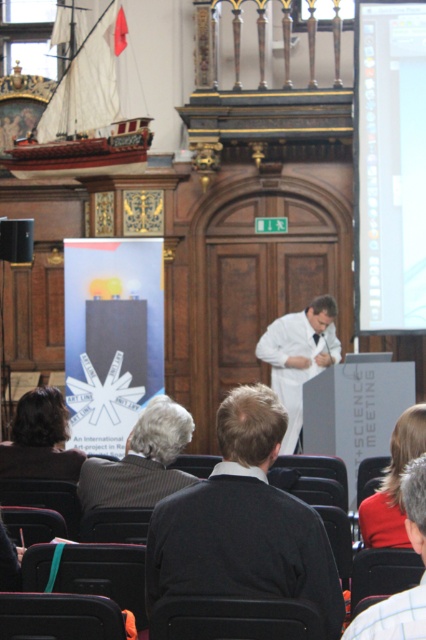
Which is more to the right, dark gray sweater at center or dark brown hair at lower left?

dark gray sweater at center is more to the right.

Can you confirm if dark gray sweater at center is positioned to the left of dark brown hair at lower left?

No, dark gray sweater at center is not to the left of dark brown hair at lower left.

Where is `dark gray sweater at center`? The width and height of the screenshot is (426, 640). dark gray sweater at center is located at coordinates (242, 522).

You are a GUI agent. You are given a task and a screenshot of the screen. Output one action in this format:
    pyautogui.click(x=<x>, y=<y>)
    Task: Click on the dark gray sweater at center
    This screenshot has width=426, height=640.
    Given the screenshot: What is the action you would take?
    242,522

Does gray woolen sweater at lower left have a smaller size compared to dark brown hair at lower left?

Incorrect, gray woolen sweater at lower left is not smaller in size than dark brown hair at lower left.

Does gray woolen sweater at lower left appear on the left side of dark brown hair at lower left?

Incorrect, gray woolen sweater at lower left is not on the left side of dark brown hair at lower left.

Find the location of a particular element. The width and height of the screenshot is (426, 640). gray woolen sweater at lower left is located at coordinates pyautogui.click(x=141, y=461).

In the scene shown: Is wooden ship at upper left taller than red fabric coat at lower right?

Indeed, wooden ship at upper left has a greater height compared to red fabric coat at lower right.

Can you confirm if wooden ship at upper left is wider than red fabric coat at lower right?

No, wooden ship at upper left is not wider than red fabric coat at lower right.

Who is more forward, (80, 106) or (403, 451)?

Positioned in front is point (403, 451).

Find the location of a particular element. wooden ship at upper left is located at coordinates (85, 115).